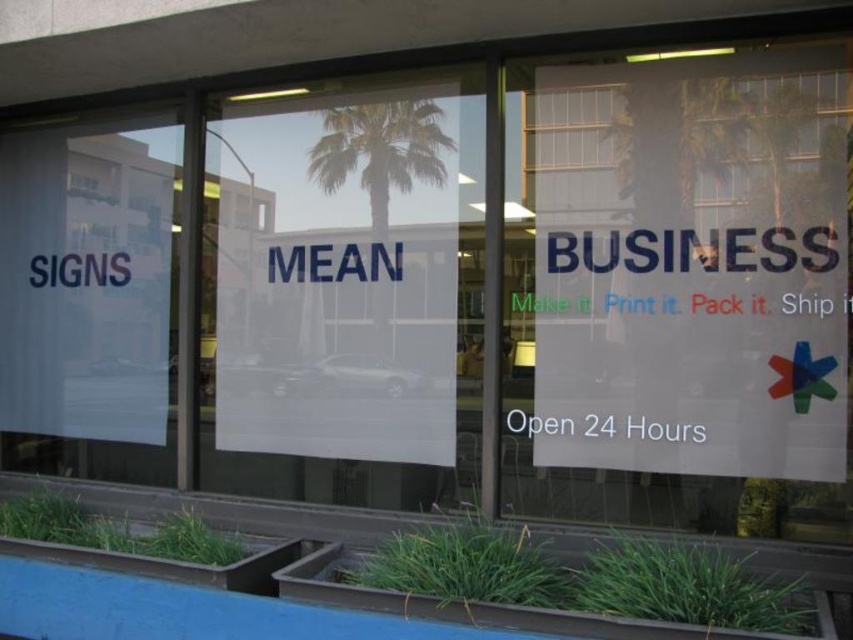
Question: Does transparent paper sign at left appear on the left side of green leafy palm tree at center?

Choices:
 (A) yes
 (B) no

Answer: (A)

Question: Does transparent paper sign at left appear over green leafy palm tree at center?

Choices:
 (A) no
 (B) yes

Answer: (A)

Question: Which point is closer to the camera taking this photo?

Choices:
 (A) (412, 140)
 (B) (59, 371)

Answer: (A)

Question: Can you confirm if transparent paper sign at left is smaller than green leafy palm tree at center?

Choices:
 (A) yes
 (B) no

Answer: (B)

Question: Among these objects, which one is nearest to the camera?

Choices:
 (A) green leafy palm tree at center
 (B) transparent paper sign at left

Answer: (A)

Question: Among these objects, which one is farthest from the camera?

Choices:
 (A) transparent paper sign at left
 (B) green leafy palm tree at center

Answer: (A)